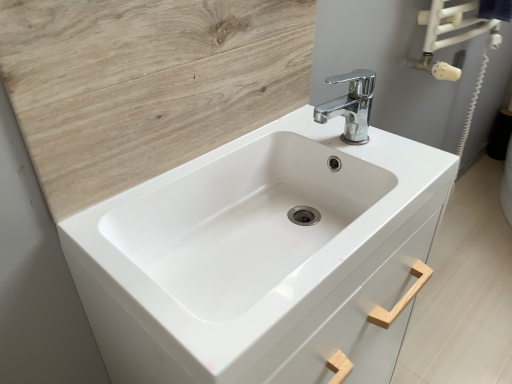
Question: Can you confirm if white glossy sink at center is thinner than wooden at upper left?

Choices:
 (A) yes
 (B) no

Answer: (B)

Question: Is white glossy sink at center directly adjacent to wooden at upper left?

Choices:
 (A) no
 (B) yes

Answer: (A)

Question: From the image's perspective, would you say white glossy sink at center is shown under wooden at upper left?

Choices:
 (A) yes
 (B) no

Answer: (A)

Question: Can you confirm if white glossy sink at center is wider than wooden at upper left?

Choices:
 (A) no
 (B) yes

Answer: (B)

Question: From a real-world perspective, is white glossy sink at center below wooden at upper left?

Choices:
 (A) no
 (B) yes

Answer: (B)

Question: Considering the positions of chrome metallic faucet at upper center and white glossy sink at center in the image, is chrome metallic faucet at upper center wider or thinner than white glossy sink at center?

Choices:
 (A) wide
 (B) thin

Answer: (B)

Question: From their relative heights in the image, would you say chrome metallic faucet at upper center is taller or shorter than white glossy sink at center?

Choices:
 (A) tall
 (B) short

Answer: (B)

Question: Considering their positions, is chrome metallic faucet at upper center located in front of or behind white glossy sink at center?

Choices:
 (A) behind
 (B) front

Answer: (A)

Question: From the image's perspective, relative to white glossy sink at center, is chrome metallic faucet at upper center above or below?

Choices:
 (A) above
 (B) below

Answer: (A)

Question: In terms of width, does wooden at upper left look wider or thinner when compared to white wood drawer at center?

Choices:
 (A) wide
 (B) thin

Answer: (B)

Question: From their relative heights in the image, would you say wooden at upper left is taller or shorter than white wood drawer at center?

Choices:
 (A) tall
 (B) short

Answer: (A)

Question: Considering the positions of wooden at upper left and white wood drawer at center in the image, is wooden at upper left bigger or smaller than white wood drawer at center?

Choices:
 (A) big
 (B) small

Answer: (B)

Question: Considering the positions of point (210, 102) and point (370, 370), is point (210, 102) closer or farther from the camera than point (370, 370)?

Choices:
 (A) closer
 (B) farther

Answer: (A)

Question: Considering their positions, is white wood drawer at center located in front of or behind chrome metallic faucet at upper center?

Choices:
 (A) behind
 (B) front

Answer: (A)

Question: Considering the positions of white wood drawer at center and chrome metallic faucet at upper center in the image, is white wood drawer at center bigger or smaller than chrome metallic faucet at upper center?

Choices:
 (A) big
 (B) small

Answer: (A)